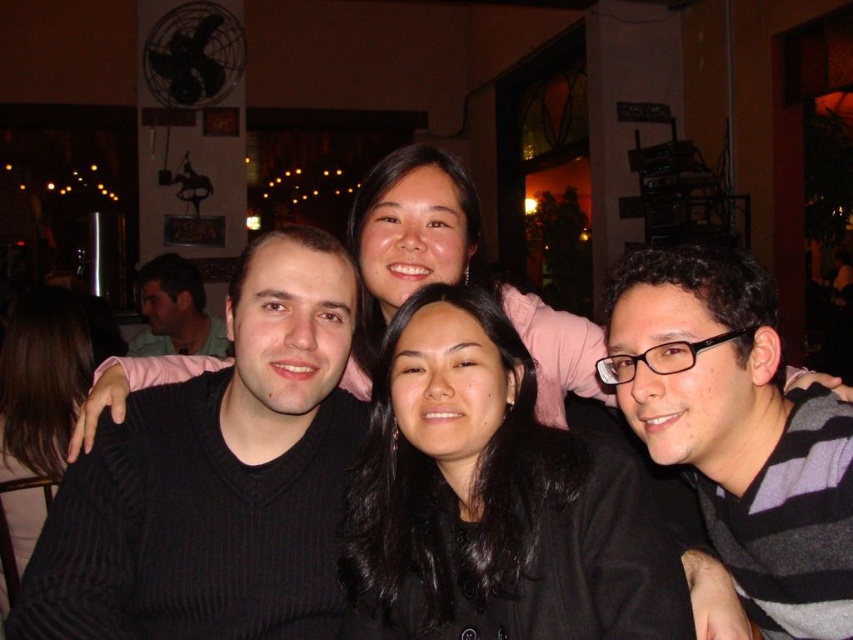
You are a photographer trying to adjust the lighting for a group photo. You notice two elements in the scene that might cast shadows on your subjects. The black matte hair at center and the matte white shirt at upper left. Which of these two elements is shorter and might cast a shorter shadow?

The black matte hair at center is not as tall as the matte white shirt at upper left, so it is shorter and would cast a shorter shadow.

You are a photographer trying to adjust the lighting for the group photo. Since the black ribbed sweater at left and the dark brown hair at lower left are in the frame, which one might cast a shorter shadow due to its height?

The black ribbed sweater at left is shorter than dark brown hair at lower left, so the black ribbed sweater at left would cast a shorter shadow.

You are a photographer standing 1.5 meters away from the camera. You want to adjust the focus on the striped sweater at center. Can you reach the camera from your current position without moving your feet?

The striped sweater at center and camera are 1.26 meters apart. Since you are 1.5 meters away from the camera, the total distance between you and the striped sweater at center would be 1.5 meters minus 1.26 meters, which equals 0.24 meters. Therefore, you can easily reach the camera to adjust the focus on the striped sweater at center without moving your feet.